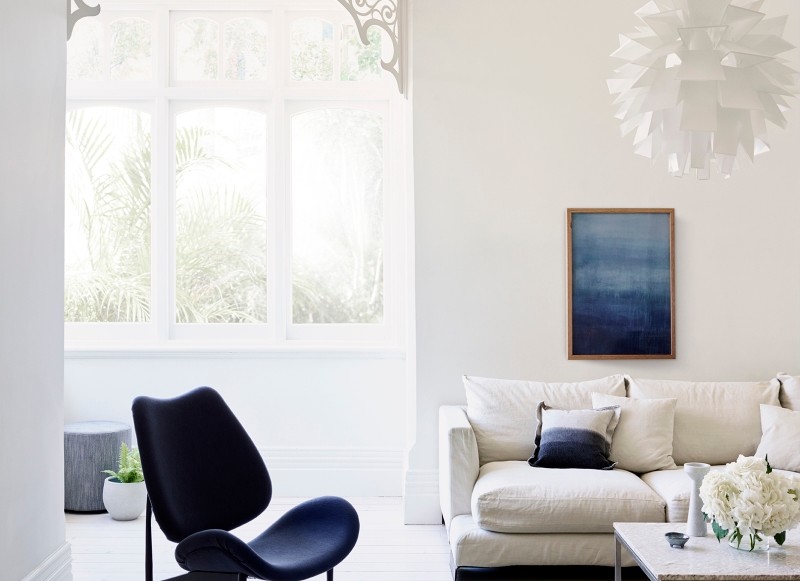
Find the location of a particular element. This screenshot has height=581, width=800. picture is located at coordinates (618, 337).